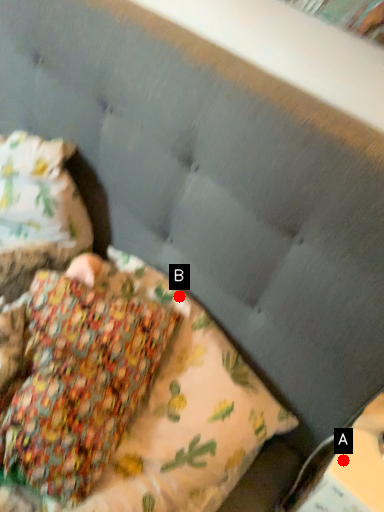
Question: Two points are circled on the image, labeled by A and B beside each circle. Which point is closer to the camera?

Choices:
 (A) A is closer
 (B) B is closer

Answer: (A)